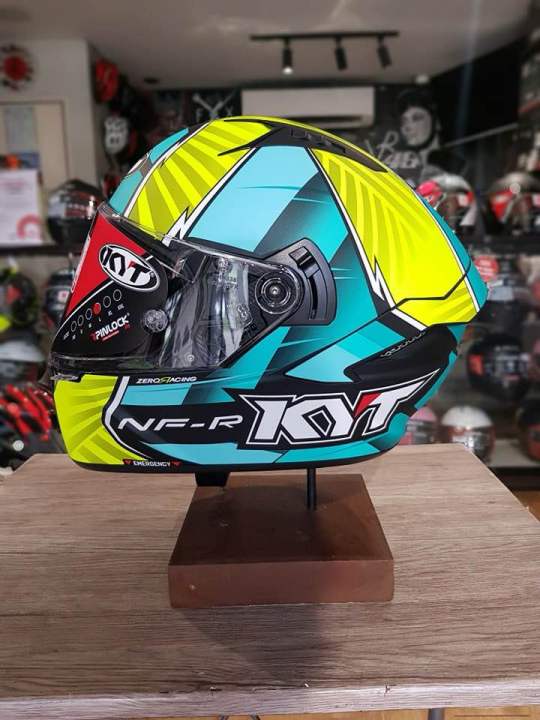
The width and height of the screenshot is (540, 720). Find the location of `wooden block`. wooden block is located at coordinates (284, 544).